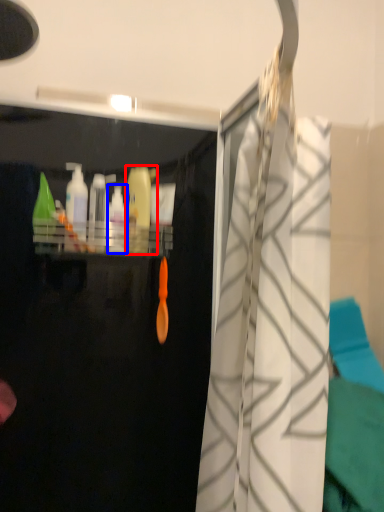
Question: Which point is further to the camera, cleaning product (highlighted by a red box) or cleaning product (highlighted by a blue box)?

Choices:
 (A) cleaning product
 (B) cleaning product

Answer: (A)